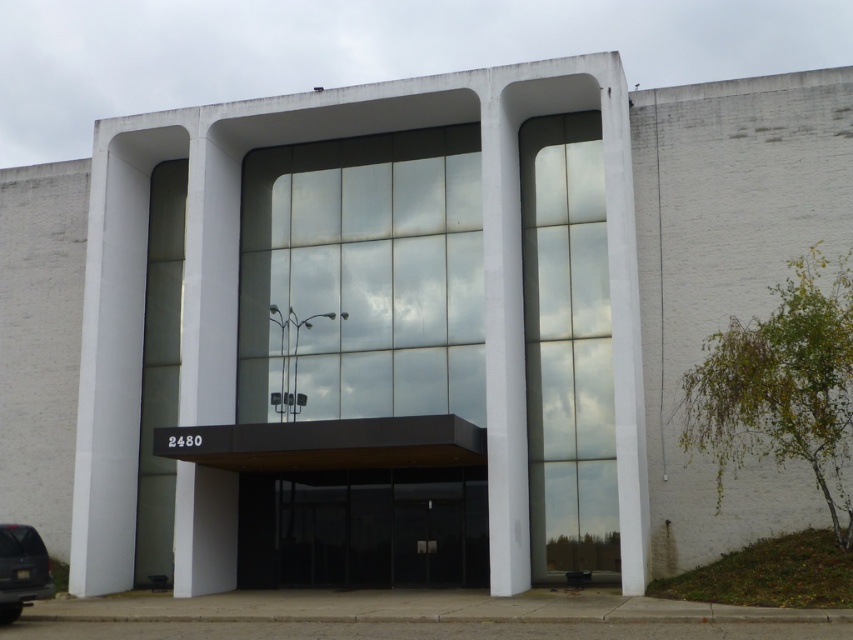
Who is positioned more to the right, transparent glass doors at center or shiny black suv at lower left?

transparent glass doors at center

Between transparent glass doors at center and shiny black suv at lower left, which one is positioned higher?

shiny black suv at lower left

This screenshot has width=853, height=640. Find the location of `transparent glass doors at center`. transparent glass doors at center is located at coordinates (363, 529).